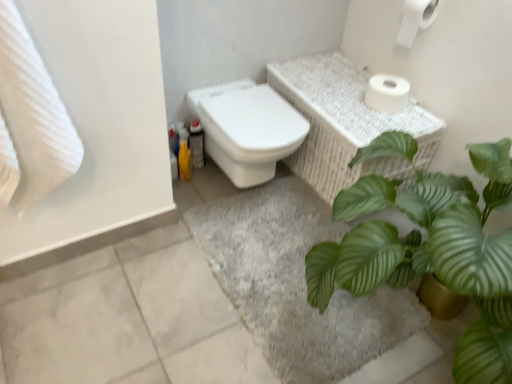
At what (x,y) coordinates should I click in order to perform the action: click on free point above white glossy toilet at center (from a real-world perspective). Please return your answer as a coordinate pair (x, y). Looking at the image, I should click on (267, 117).